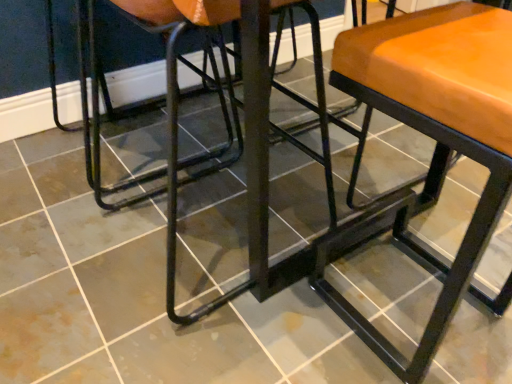
This screenshot has width=512, height=384. Find the location of `black metal swivel chair at left`. black metal swivel chair at left is located at coordinates (166, 100).

Describe the element at coordinates (166, 100) in the screenshot. I see `black metal swivel chair at left` at that location.

Describe the element at coordinates (436, 140) in the screenshot. I see `matte orange cushioned stool at center` at that location.

Locate an element on the screen. matte orange cushioned stool at center is located at coordinates (436, 140).

Where is `black metal swivel chair at left`? The image size is (512, 384). black metal swivel chair at left is located at coordinates (166, 100).

Considering the positions of objects black metal swivel chair at left and matte orange cushioned stool at center in the image provided, who is more to the left, black metal swivel chair at left or matte orange cushioned stool at center?

black metal swivel chair at left.

Considering their positions, is black metal swivel chair at left located in front of or behind matte orange cushioned stool at center?

In the image, black metal swivel chair at left appears behind matte orange cushioned stool at center.

Which is closer, (228, 117) or (459, 78)?

Point (228, 117) appears to be farther away from the viewer than point (459, 78).

From the image's perspective, relative to matte orange cushioned stool at center, is black metal swivel chair at left above or below?

From the image's perspective, black metal swivel chair at left appears above matte orange cushioned stool at center.

From a real-world perspective, is black metal swivel chair at left above or below matte orange cushioned stool at center?

black metal swivel chair at left is situated lower than matte orange cushioned stool at center in the real world.

Which object is thinner, black metal swivel chair at left or matte orange cushioned stool at center?

matte orange cushioned stool at center is thinner.

Is black metal swivel chair at left taller or shorter than matte orange cushioned stool at center?

In the image, black metal swivel chair at left appears to be shorter than matte orange cushioned stool at center.

Who is bigger, black metal swivel chair at left or matte orange cushioned stool at center?

With larger size is black metal swivel chair at left.

In the scene shown: Would you say matte orange cushioned stool at center is part of black metal swivel chair at left's contents?

No, matte orange cushioned stool at center is not surrounded by black metal swivel chair at left.

Is there a large distance between black metal swivel chair at left and matte orange cushioned stool at center?

Actually, black metal swivel chair at left and matte orange cushioned stool at center are a little close together.

Could you tell me if black metal swivel chair at left is facing matte orange cushioned stool at center?

No, black metal swivel chair at left is not turned towards matte orange cushioned stool at center.

Can you tell me how much black metal swivel chair at left and matte orange cushioned stool at center differ in facing direction?

They differ by 90.8 degrees in their facing directions.

How far apart are black metal swivel chair at left and matte orange cushioned stool at center?

black metal swivel chair at left is 36.08 inches away from matte orange cushioned stool at center.

Locate an element on the screen. This screenshot has width=512, height=384. stool located below the black metal swivel chair at left (from the image's perspective) is located at coordinates (436, 140).

Is matte orange cushioned stool at center at the left side of black metal swivel chair at left?

Incorrect, matte orange cushioned stool at center is not on the left side of black metal swivel chair at left.

Is matte orange cushioned stool at center closer to camera compared to black metal swivel chair at left?

Yes.

Is point (471, 4) closer or farther from the camera than point (173, 141)?

Point (471, 4) is positioned farther from the camera compared to point (173, 141).

From the image's perspective, is matte orange cushioned stool at center on black metal swivel chair at left?

Actually, matte orange cushioned stool at center appears below black metal swivel chair at left in the image.

From a real-world perspective, is matte orange cushioned stool at center on black metal swivel chair at left?

Yes.

Considering the relative sizes of matte orange cushioned stool at center and black metal swivel chair at left in the image provided, is matte orange cushioned stool at center wider than black metal swivel chair at left?

In fact, matte orange cushioned stool at center might be narrower than black metal swivel chair at left.

Considering the sizes of objects matte orange cushioned stool at center and black metal swivel chair at left in the image provided, who is shorter, matte orange cushioned stool at center or black metal swivel chair at left?

With less height is black metal swivel chair at left.

Is matte orange cushioned stool at center bigger or smaller than black metal swivel chair at left?

Considering their sizes, matte orange cushioned stool at center takes up less space than black metal swivel chair at left.

Is matte orange cushioned stool at center situated inside black metal swivel chair at left or outside?

matte orange cushioned stool at center is not enclosed by black metal swivel chair at left.

Is there a large distance between matte orange cushioned stool at center and black metal swivel chair at left?

matte orange cushioned stool at center is near black metal swivel chair at left, not far away.

Is matte orange cushioned stool at center oriented away from black metal swivel chair at left?

matte orange cushioned stool at center does not have its back to black metal swivel chair at left.

Measure the distance from matte orange cushioned stool at center to black metal swivel chair at left.

The distance of matte orange cushioned stool at center from black metal swivel chair at left is 36.08 inches.

Locate an element on the screen. swivel chair beneath the matte orange cushioned stool at center (from a real-world perspective) is located at coordinates (166, 100).

Image resolution: width=512 pixels, height=384 pixels. Identify the location of swivel chair that appears below the matte orange cushioned stool at center (from a real-world perspective). (166, 100).

Image resolution: width=512 pixels, height=384 pixels. Find the location of `stool lying on the right of black metal swivel chair at left`. stool lying on the right of black metal swivel chair at left is located at coordinates (436, 140).